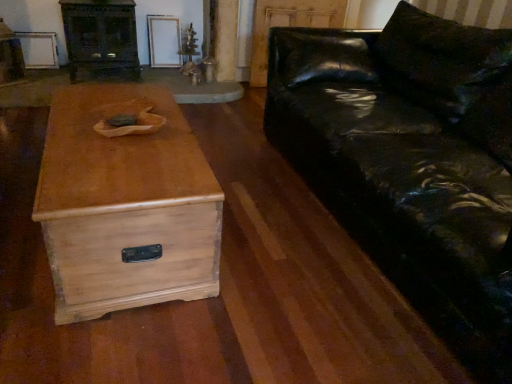
The image size is (512, 384). Identify the location of light wood chest at center. (125, 205).

The image size is (512, 384). Find the location of `dark wood entertainment center at upper left`. dark wood entertainment center at upper left is located at coordinates (100, 36).

Where is `light wood chest at center`? The image size is (512, 384). light wood chest at center is located at coordinates (125, 205).

Does point (472, 26) come behind point (178, 194)?

Yes, it is behind point (178, 194).

Can you confirm if glossy black leather couch at right is positioned to the left of light wood chest at center?

Incorrect, glossy black leather couch at right is not on the left side of light wood chest at center.

From a real-world perspective, is glossy black leather couch at right physically located above or below light wood chest at center?

In terms of real-world spatial position, glossy black leather couch at right is above light wood chest at center.

From the image's perspective, which object appears higher, glossy black leather couch at right or light wood chest at center?

From the image's view, glossy black leather couch at right is above.

Considering the relative sizes of light wood chest at center and dark wood entertainment center at upper left in the image provided, is light wood chest at center wider than dark wood entertainment center at upper left?

Indeed, light wood chest at center has a greater width compared to dark wood entertainment center at upper left.

From the image's perspective, between light wood chest at center and dark wood entertainment center at upper left, which one is located above?

From the image's view, dark wood entertainment center at upper left is above.

Is light wood chest at center at the right side of dark wood entertainment center at upper left?

Correct, you'll find light wood chest at center to the right of dark wood entertainment center at upper left.

Is dark wood entertainment center at upper left positioned with its back to glossy black leather couch at right?

No, glossy black leather couch at right is not at the back of dark wood entertainment center at upper left.

Where is `entertainment center that appears behind the glossy black leather couch at right`? entertainment center that appears behind the glossy black leather couch at right is located at coordinates (100, 36).

Considering the relative sizes of dark wood entertainment center at upper left and glossy black leather couch at right in the image provided, is dark wood entertainment center at upper left wider than glossy black leather couch at right?

Incorrect, the width of dark wood entertainment center at upper left does not surpass that of glossy black leather couch at right.

From a real-world perspective, which object rests below the other?

light wood chest at center is physically lower.

Considering the relative sizes of dark wood entertainment center at upper left and light wood chest at center in the image provided, is dark wood entertainment center at upper left bigger than light wood chest at center?

Actually, dark wood entertainment center at upper left might be smaller than light wood chest at center.

Is dark wood entertainment center at upper left not within light wood chest at center?

Indeed, dark wood entertainment center at upper left is completely outside light wood chest at center.

Is point (66, 0) less distant than point (115, 273)?

No, it is behind (115, 273).

From the image's perspective, which one is positioned lower, light wood chest at center or glossy black leather couch at right?

light wood chest at center appears lower in the image.

Does light wood chest at center touch glossy black leather couch at right?

light wood chest at center is not next to glossy black leather couch at right, and they're not touching.

Does glossy black leather couch at right lie in front of dark wood entertainment center at upper left?

Yes, it is.

Considering the relative positions of glossy black leather couch at right and dark wood entertainment center at upper left in the image provided, is glossy black leather couch at right to the left or to the right of dark wood entertainment center at upper left?

glossy black leather couch at right is to the right of dark wood entertainment center at upper left.

Which point is more distant from viewer, (x=417, y=136) or (x=116, y=24)?

The point (x=116, y=24) is more distant.

Is glossy black leather couch at right directly adjacent to dark wood entertainment center at upper left?

glossy black leather couch at right and dark wood entertainment center at upper left are not in contact.

Image resolution: width=512 pixels, height=384 pixels. Find the location of `studio couch on the right of light wood chest at center`. studio couch on the right of light wood chest at center is located at coordinates (412, 162).

The image size is (512, 384). I want to click on the chest of drawers that appears below the dark wood entertainment center at upper left (from a real-world perspective), so pyautogui.click(x=125, y=205).

Based on their spatial positions, is glossy black leather couch at right or dark wood entertainment center at upper left closer to light wood chest at center?

glossy black leather couch at right is closer to light wood chest at center.

When comparing their distances from dark wood entertainment center at upper left, does light wood chest at center or glossy black leather couch at right seem closer?

Based on the image, light wood chest at center appears to be nearer to dark wood entertainment center at upper left.

In the scene shown: From the image, which object appears to be farther from glossy black leather couch at right, light wood chest at center or dark wood entertainment center at upper left?

dark wood entertainment center at upper left is further to glossy black leather couch at right.

Based on their spatial positions, is dark wood entertainment center at upper left or glossy black leather couch at right further from light wood chest at center?

dark wood entertainment center at upper left.

Considering their positions, is dark wood entertainment center at upper left positioned further to glossy black leather couch at right than light wood chest at center?

dark wood entertainment center at upper left is positioned further to the anchor glossy black leather couch at right.

Consider the image. From the image, which object appears to be farther from dark wood entertainment center at upper left, glossy black leather couch at right or light wood chest at center?

glossy black leather couch at right lies further to dark wood entertainment center at upper left than the other object.

At what (x,y) coordinates should I click in order to perform the action: click on the chest of drawers located between glossy black leather couch at right and dark wood entertainment center at upper left in the depth direction. Please return your answer as a coordinate pair (x, y). The height and width of the screenshot is (384, 512). Looking at the image, I should click on (x=125, y=205).